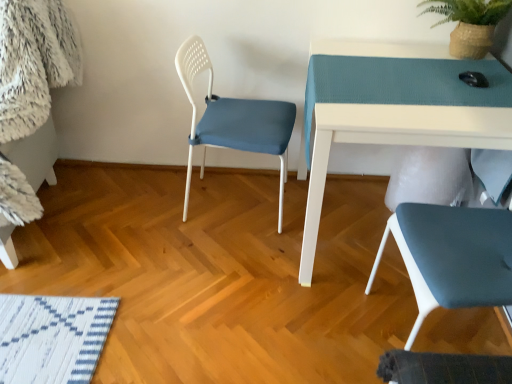
At what (x,y) coordinates should I click in order to perform the action: click on vacant space in front of white plastic chair at center, which is the second chair from right to left. Please return your answer as a coordinate pair (x, y). The width and height of the screenshot is (512, 384). Looking at the image, I should click on (223, 276).